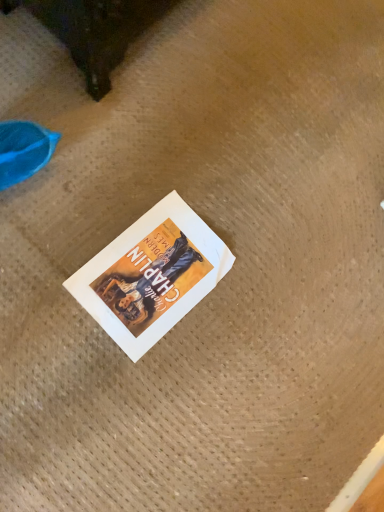
Find the location of `blank space above white paper book at center (from a real-world perspective)`. blank space above white paper book at center (from a real-world perspective) is located at coordinates (152, 271).